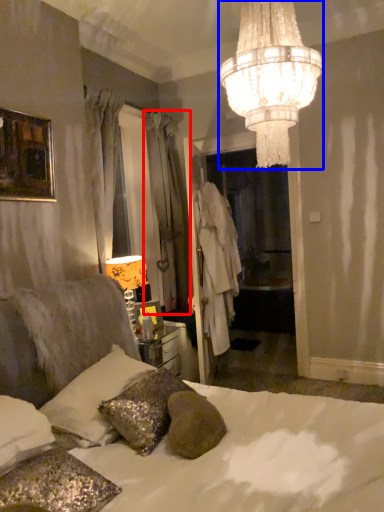
Question: Which object appears closest to the camera in this image, curtain (highlighted by a red box) or lamp (highlighted by a blue box)?

Choices:
 (A) curtain
 (B) lamp

Answer: (B)